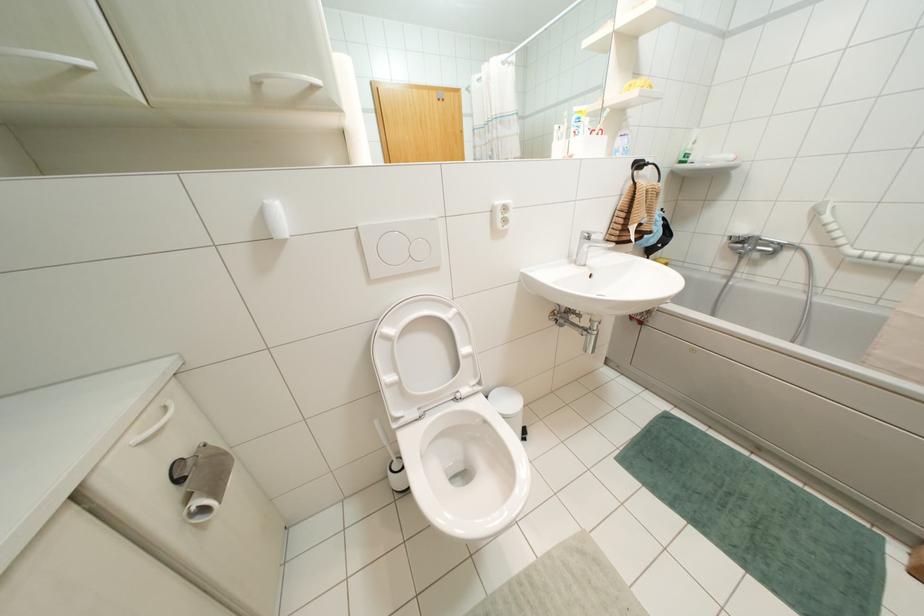
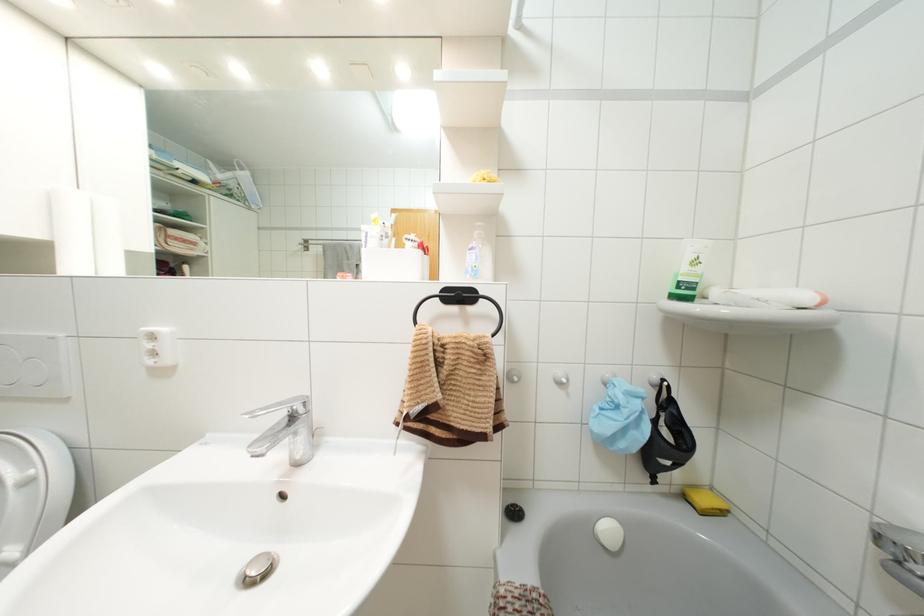
The point at (x=694, y=142) is marked in the first image. Where is the corresponding point in the second image?

(695, 262)